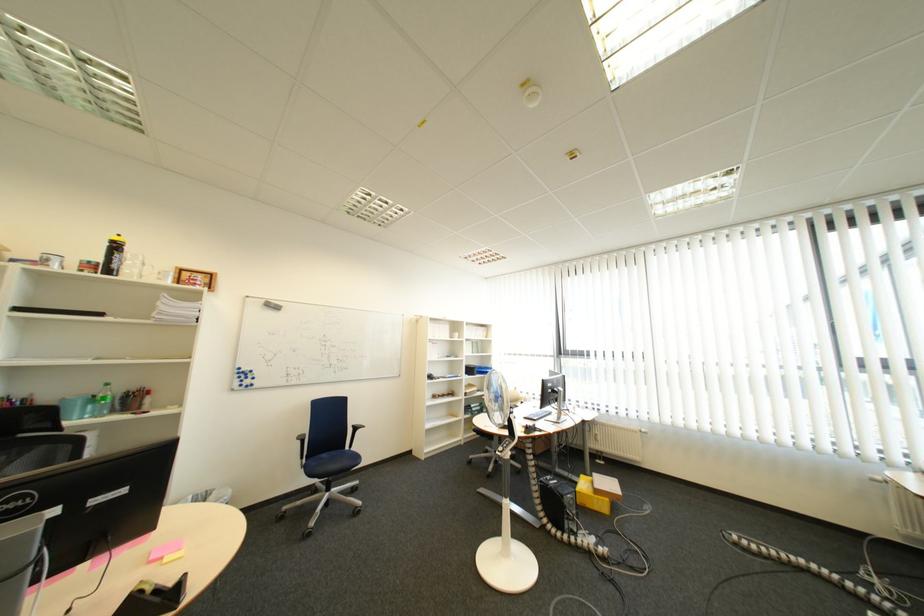
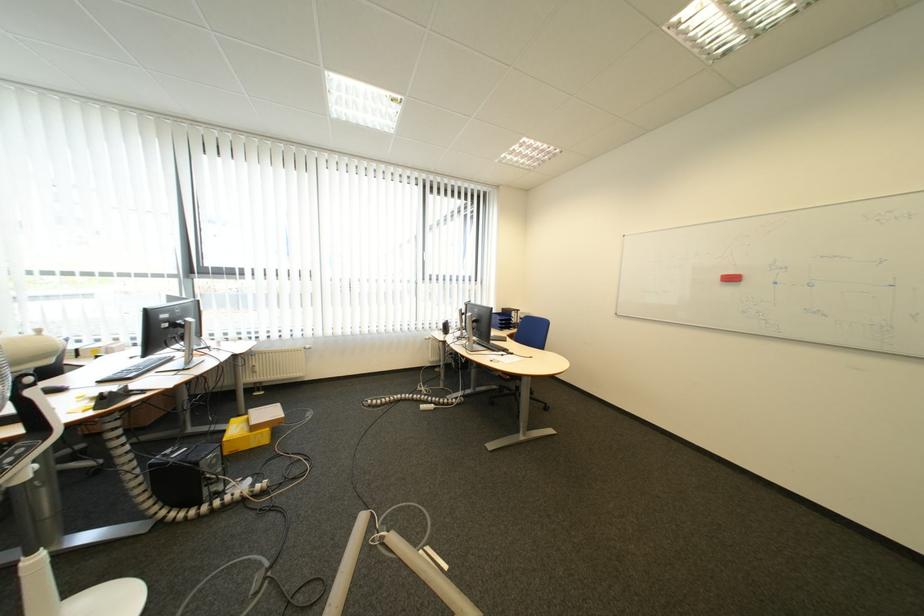
Question: The camera is either moving clockwise (left) or counter-clockwise (right) around the object. The first image is from the beginning of the video and the second image is from the end. Is the camera moving left or right when shooting the video?

Choices:
 (A) Left
 (B) Right

Answer: (A)